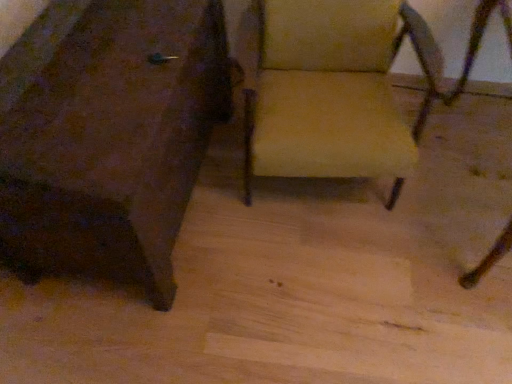
Question: From a real-world perspective, is matte brown chair at center, the 1th chair in the left-to-right sequence, above or below beige fabric chair at center, which is counted as the first chair, starting from the right?

Choices:
 (A) above
 (B) below

Answer: (B)

Question: Is point (131, 195) positioned closer to the camera than point (374, 168)?

Choices:
 (A) farther
 (B) closer

Answer: (B)

Question: Is matte brown chair at center, which ranks as the 2th chair in right-to-left order, situated inside beige fabric chair at center, which is counted as the first chair, starting from the right, or outside?

Choices:
 (A) inside
 (B) outside

Answer: (B)

Question: Considering the positions of point (361, 94) and point (135, 218), is point (361, 94) closer or farther from the camera than point (135, 218)?

Choices:
 (A) farther
 (B) closer

Answer: (A)

Question: Considering the positions of beige fabric chair at center, which is the second chair in left-to-right order, and matte brown chair at center, the 1th chair in the left-to-right sequence, in the image, is beige fabric chair at center, which is the second chair in left-to-right order, bigger or smaller than matte brown chair at center, the 1th chair in the left-to-right sequence,?

Choices:
 (A) small
 (B) big

Answer: (A)

Question: Is beige fabric chair at center, which is the second chair in left-to-right order, to the left or to the right of matte brown chair at center, the 1th chair in the left-to-right sequence, in the image?

Choices:
 (A) right
 (B) left

Answer: (A)

Question: From the image's perspective, is beige fabric chair at center, which is counted as the first chair, starting from the right, positioned above or below matte brown chair at center, which ranks as the 2th chair in right-to-left order?

Choices:
 (A) above
 (B) below

Answer: (A)